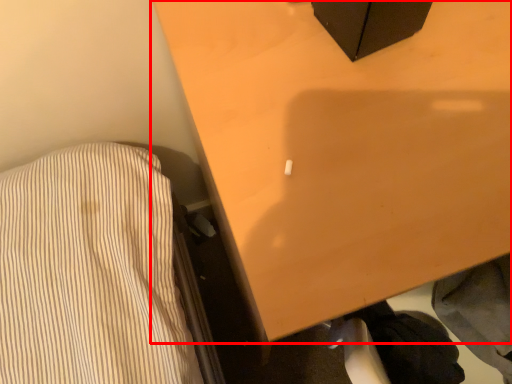
Question: Considering the relative positions of furniture (annotated by the red box) and clothing in the image provided, where is furniture (annotated by the red box) located with respect to the staircase?

Choices:
 (A) right
 (B) left

Answer: (A)